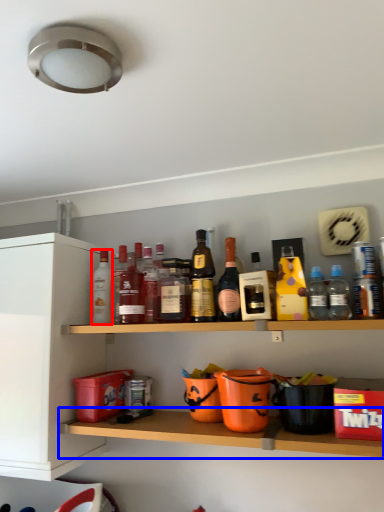
Question: Which object is closer to the camera taking this photo, bottle (highlighted by a red box) or shelf (highlighted by a blue box)?

Choices:
 (A) bottle
 (B) shelf

Answer: (B)